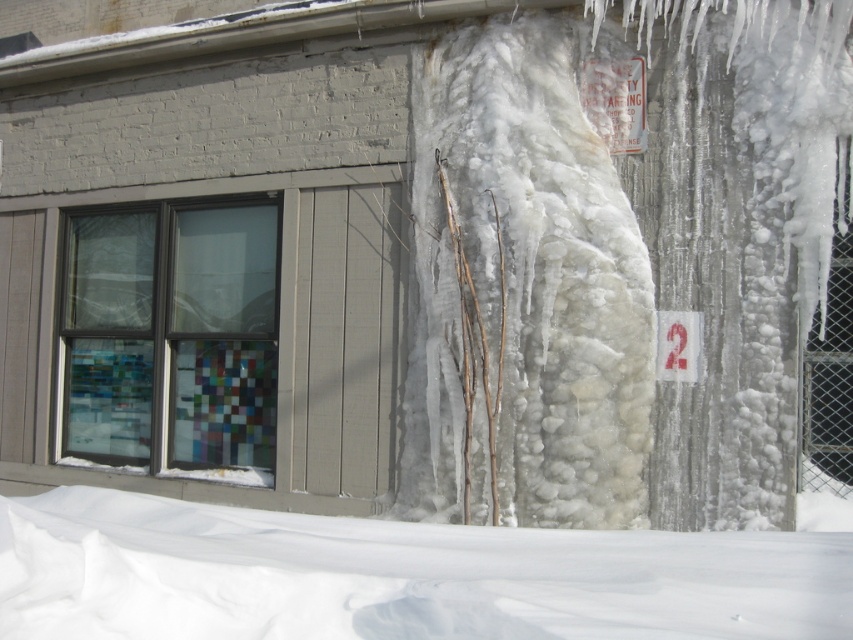
How far apart are translucent ice at center and white fluffy snow at lower center?

The distance of translucent ice at center from white fluffy snow at lower center is 3.46 meters.

The width and height of the screenshot is (853, 640). What do you see at coordinates (525, 291) in the screenshot? I see `translucent ice at center` at bounding box center [525, 291].

Find the location of `translucent ice at center`. translucent ice at center is located at coordinates (525, 291).